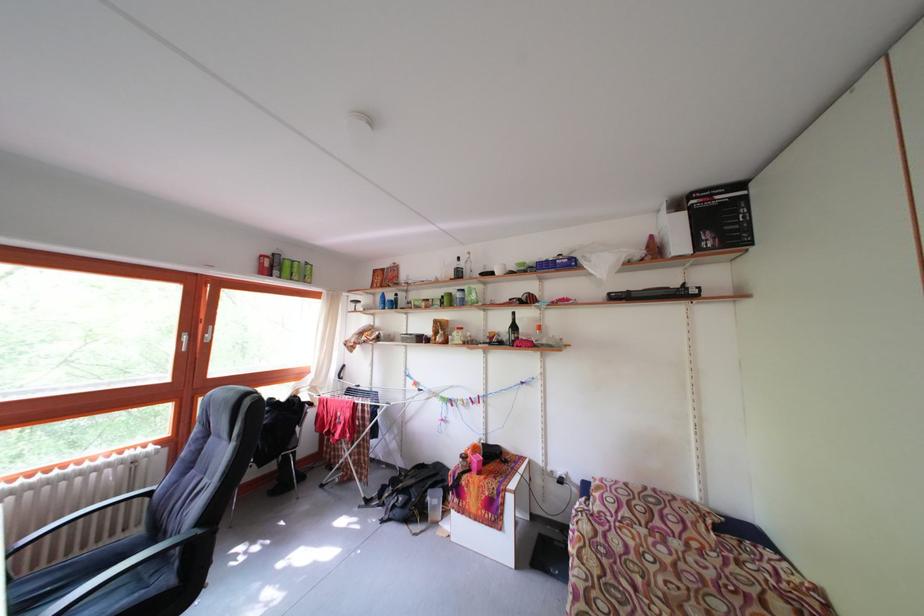
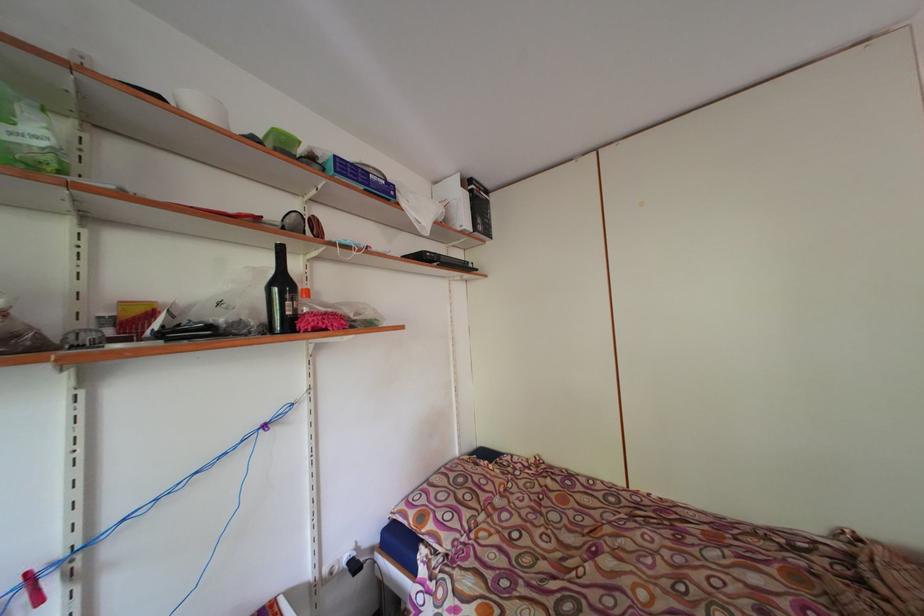
The point at (523, 333) is marked in the first image. Where is the corresponding point in the second image?

(290, 289)